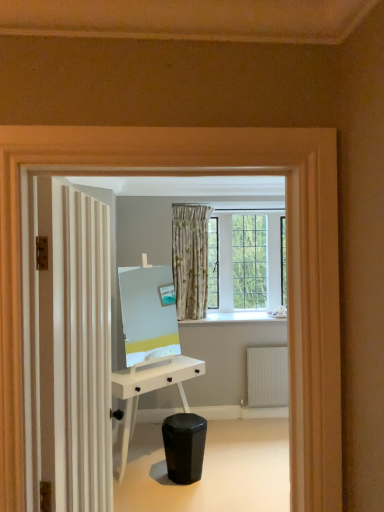
Identify the location of free space in front of black matte swivel chair at lower center. (203, 498).